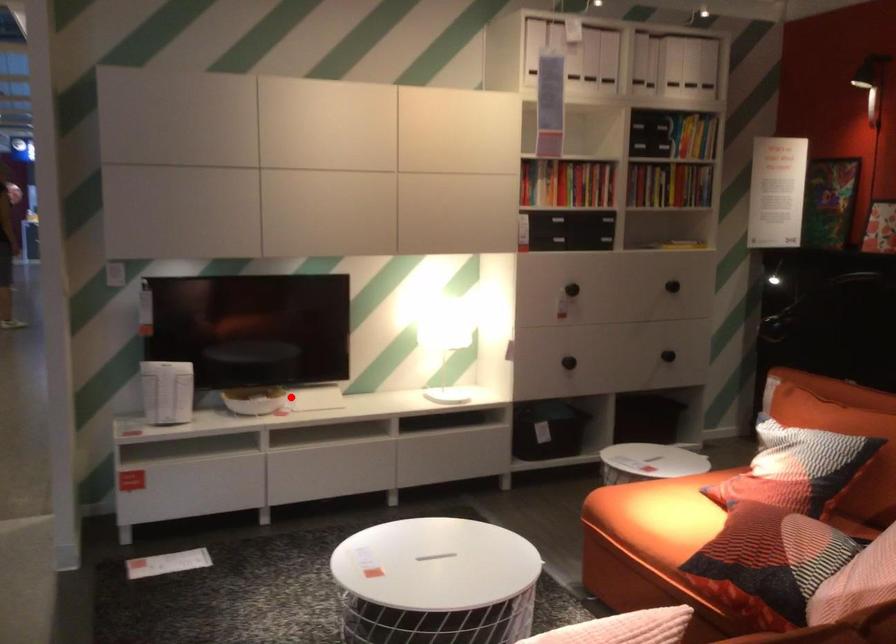
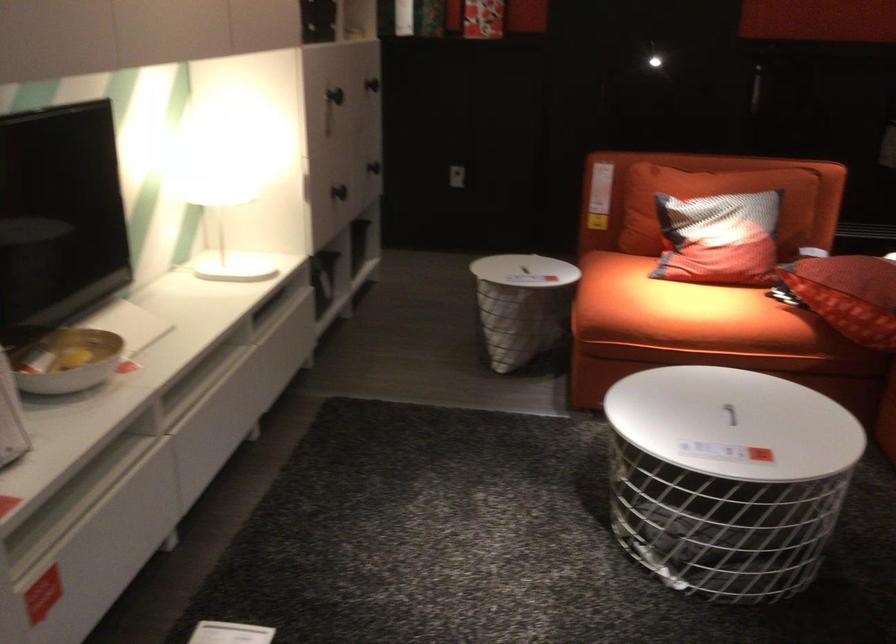
Where in the second image is the point corresponding to the highlighted location from the first image?

(66, 361)